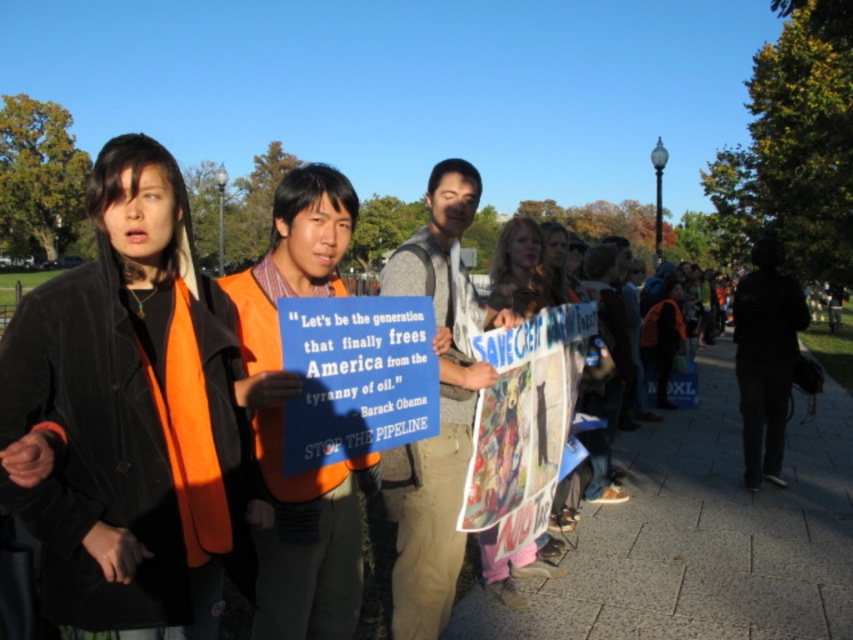
Is point (169, 323) more distant than point (766, 368)?

No, it is not.

Looking at this image, does velvet black coat at center appear on the right side of dark gray pants at right?

Incorrect, velvet black coat at center is not on the right side of dark gray pants at right.

I want to click on velvet black coat at center, so click(132, 419).

Where is `velvet black coat at center`? velvet black coat at center is located at coordinates (132, 419).

Measure the distance from velvet black coat at center to orange safety vest at center.

velvet black coat at center and orange safety vest at center are 4.33 meters apart from each other.

Which is more to the right, velvet black coat at center or orange safety vest at center?

Positioned to the right is orange safety vest at center.

Image resolution: width=853 pixels, height=640 pixels. I want to click on velvet black coat at center, so click(132, 419).

Does point (457, 483) come in front of point (604, 244)?

Yes, it is.

Looking at this image, is matte blue sign at center positioned before orange safety vest at center?

Yes, it is in front of orange safety vest at center.

Is point (434, 557) positioned in front of point (631, 374)?

That is True.

I want to click on matte blue sign at center, so click(x=440, y=419).